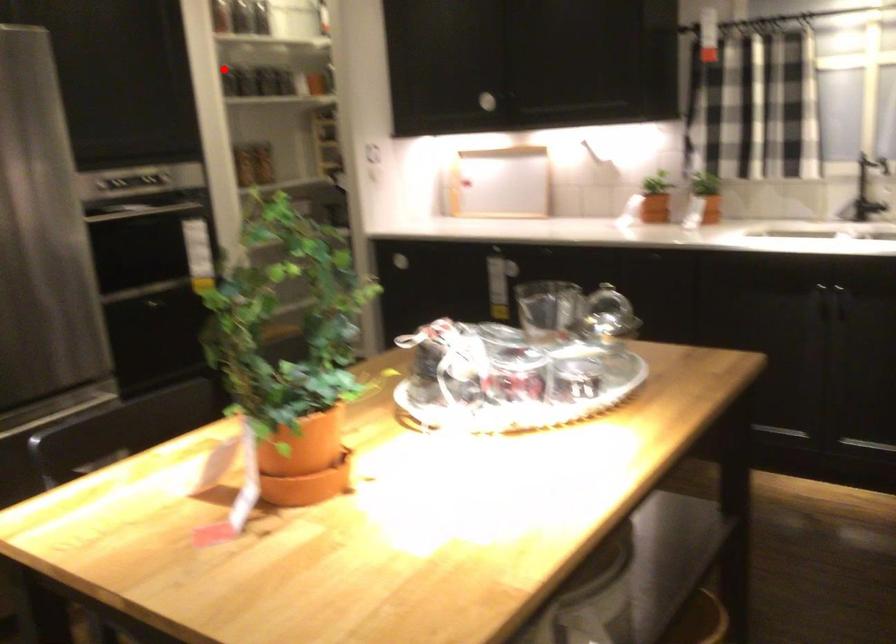
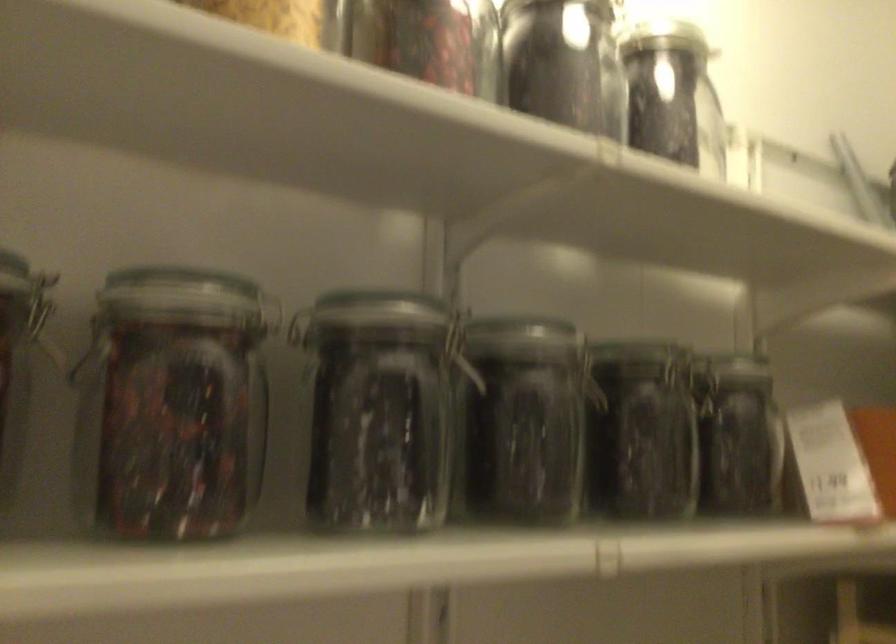
Question: I am providing you with two images of the same scene from different viewpoints. Given a red point in image1, look at the same physical point in image2. Is it:

Choices:
 (A) Closer to the viewpoint
 (B) Farther from the viewpoint

Answer: (A)